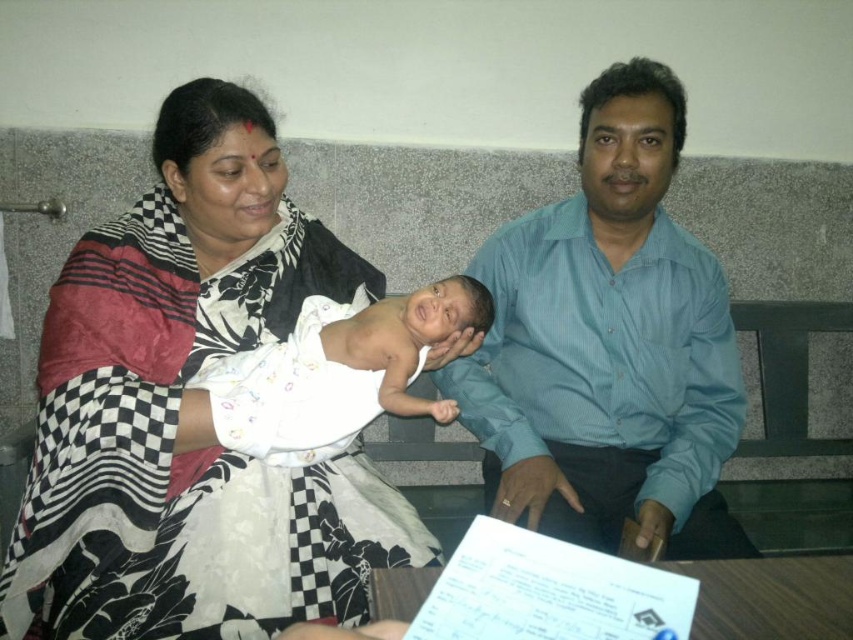
You are a photographer standing at the camera position. You want to capture a closeup shot of the black checkered saree at upper left. Can you move closer to it without exceeding the 1 meter distance limit set by the museum for artifacts?

The black checkered saree at upper left is 1.12 meters from camera, which is beyond the 1 meter limit set by the museum. Therefore, you cannot move closer to it to take the closeup shot.

You are a photographer preparing to take a family portrait. The scene has the black checkered saree at upper left and the white clothed newborn at center. Which object should you focus on first if you want to ensure both are in frame without moving the camera?

You should focus on the black checkered saree at upper left first because it is larger in size compared to the white clothed newborn at center, ensuring it fits within the frame while the smaller newborn will also be captured.

You are a photographer taking a picture of the blue striped shirt at center and the white clothed newborn at center. Which object should you focus on first if you want to capture both in the same frame without moving the camera?

The blue striped shirt at center is positioned on the right side of white clothed newborn at center, so you should focus on the white clothed newborn at center first to ensure both are in frame without moving the camera.